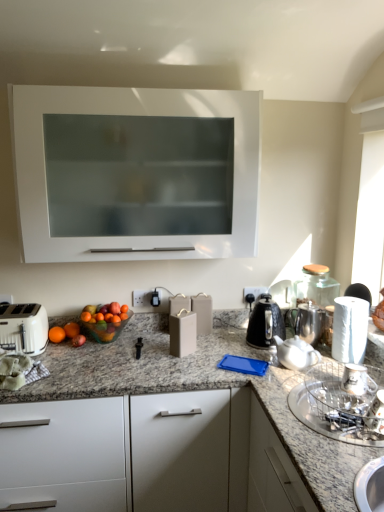
Locate an element on the screen. white matte cabinet at lower left, which appears as the first cabinetry when ordered from the bottom is located at coordinates (148, 455).

Measure the distance between stainless steel dish rack at lower right, the 2th appliance when ordered from right to left, and camera.

stainless steel dish rack at lower right, the 2th appliance when ordered from right to left, and camera are 4.22 feet apart.

At what (x,y) coordinates should I click in order to perform the action: click on stainless steel dish rack at lower right, the 2th appliance when ordered from right to left. Please return your answer as a coordinate pair (x, y). This screenshot has width=384, height=512. Looking at the image, I should click on (342, 403).

Where is `translucent glass bowl of mixed fruits at center-left`? Image resolution: width=384 pixels, height=512 pixels. translucent glass bowl of mixed fruits at center-left is located at coordinates [x=105, y=321].

Measure the distance between translucent glass bowl of mixed fruits at center-left and camera.

The depth of translucent glass bowl of mixed fruits at center-left is 6.62 feet.

Locate an element on the screen. This screenshot has width=384, height=512. white paper towel at right is located at coordinates (350, 329).

What is the approximate height of white paper towel at right?

white paper towel at right is 10.55 inches in height.

The image size is (384, 512). I want to click on black plastic electrical outlet at center, so click(253, 293).

Does orange matte at left turn towards white plastic toaster at lower left?

No, orange matte at left is not facing towards white plastic toaster at lower left.

Does point (50, 339) come closer to viewer compared to point (0, 309)?

No, it is behind (0, 309).

What's the angular difference between orange matte at left and white plastic toaster at lower left's facing directions?

The angular difference between orange matte at left and white plastic toaster at lower left is 0.0015 degrees.

Is translucent glass bowl of mixed fruits at center-left touching white plastic toaster at lower left?

No, translucent glass bowl of mixed fruits at center-left is not touching white plastic toaster at lower left.

Does translucent glass bowl of mixed fruits at center-left have a smaller size compared to white plastic toaster at lower left?

Yes.

Is translucent glass bowl of mixed fruits at center-left completely or partially outside of white plastic toaster at lower left?

Yes.

Where is `toaster below the translucent glass bowl of mixed fruits at center-left (from the image's perspective)`? The image size is (384, 512). toaster below the translucent glass bowl of mixed fruits at center-left (from the image's perspective) is located at coordinates (23, 328).

Is the position of white ceramic teapot at right more distant than that of black metallic kettle at right?

That is False.

Between point (289, 350) and point (266, 330), which one is positioned behind?

The point (266, 330) is more distant.

Measure the distance between white ceramic teapot at right and black metallic kettle at right.

The distance of white ceramic teapot at right from black metallic kettle at right is 9.73 inches.

Can you confirm if white ceramic teapot at right is shorter than black metallic kettle at right?

Yes, white ceramic teapot at right is shorter than black metallic kettle at right.

Between orange matte at left and white ceramic teapot at right, which one has larger size?

white ceramic teapot at right.

From a real-world perspective, is orange matte at left located higher than white ceramic teapot at right?

No, from a real-world perspective, orange matte at left is not above white ceramic teapot at right.

Does orange matte at left touch white ceramic teapot at right?

No, orange matte at left is not in contact with white ceramic teapot at right.

Is orange matte at left at the left side of white ceramic teapot at right?

Result: Correct, you'll find orange matte at left to the left of white ceramic teapot at right.

Considering the positions of point (44, 198) and point (364, 378), is point (44, 198) closer or farther from the camera than point (364, 378)?

Point (44, 198) is farther from the camera than point (364, 378).

At what (x,y) coordinates should I click in order to perform the action: click on cabinetry above the metallic silver cup at lower right, which is counted as the 2th appliance, starting from the back (from a real-world perspective). Please return your answer as a coordinate pair (x, y). Image resolution: width=384 pixels, height=512 pixels. Looking at the image, I should click on (135, 172).

Considering the sizes of white matte cabinet at upper center, which appears as the 2th cabinetry when ordered from the bottom, and metallic silver cup at lower right, the second appliance positioned from the front, in the image, is white matte cabinet at upper center, which appears as the 2th cabinetry when ordered from the bottom, wider or thinner than metallic silver cup at lower right, the second appliance positioned from the front,?

Considering their sizes, white matte cabinet at upper center, which appears as the 2th cabinetry when ordered from the bottom, looks broader than metallic silver cup at lower right, the second appliance positioned from the front.

Does white matte cabinet at upper center, positioned as the first cabinetry in top-to-bottom order, appear on the right side of metallic silver cup at lower right, the second appliance positioned from the front?

No.

Is white paper towel at right looking in the opposite direction of translucent glass bowl of mixed fruits at center-left?

No, white paper towel at right is not facing the opposite direction of translucent glass bowl of mixed fruits at center-left.

From the image's perspective, is white paper towel at right beneath translucent glass bowl of mixed fruits at center-left?

No, from the image's perspective, white paper towel at right is not below translucent glass bowl of mixed fruits at center-left.

Are white paper towel at right and translucent glass bowl of mixed fruits at center-left beside each other?

No, white paper towel at right is not touching translucent glass bowl of mixed fruits at center-left.

Is white paper towel at right surrounding translucent glass bowl of mixed fruits at center-left?

Definitely not — translucent glass bowl of mixed fruits at center-left is not inside white paper towel at right.

From the picture: From the image's perspective, is orange matte at left beneath translucent glass bowl of mixed fruits at center-left?

Yes, from the image's perspective, orange matte at left is below translucent glass bowl of mixed fruits at center-left.

Consider the image. Between orange matte at left and translucent glass bowl of mixed fruits at center-left, which one has less height?

orange matte at left.

Is orange matte at left further to the viewer compared to translucent glass bowl of mixed fruits at center-left?

That is True.

Based on their positions, is orange matte at left located to the left or right of translucent glass bowl of mixed fruits at center-left?

orange matte at left is to the left of translucent glass bowl of mixed fruits at center-left.

In the image, there is a white plastic toaster at lower left. Where is `citrus fruit below it (from the image's perspective)`? The height and width of the screenshot is (512, 384). citrus fruit below it (from the image's perspective) is located at coordinates tap(67, 334).

Image resolution: width=384 pixels, height=512 pixels. In order to click on toaster that appears in front of the translucent glass bowl of mixed fruits at center-left in this screenshot , I will do `click(23, 328)`.

Estimate the real-world distances between objects in this image. Which object is further from translucent glass bowl of mixed fruits at center-left, black plastic electrical outlet at center or metallic silver cup at lower right, which is counted as the 2th appliance, starting from the back?

metallic silver cup at lower right, which is counted as the 2th appliance, starting from the back.

Looking at the image, which one is located further to white ceramic teapot at right, metallic silver cup at lower right, acting as the 1th appliance starting from the right, or white matte cabinet at lower left, which appears as the first cabinetry when ordered from the bottom?

white matte cabinet at lower left, which appears as the first cabinetry when ordered from the bottom, lies further to white ceramic teapot at right than the other object.

Consider the image. Looking at the image, which one is located further to metallic silver cup at lower right, which is counted as the 2th appliance, starting from the back, matte gray wine box at center, the third appliance from the front, or stainless steel dish rack at lower right, acting as the 3th appliance starting from the back?

matte gray wine box at center, the third appliance from the front, is positioned further to the anchor metallic silver cup at lower right, which is counted as the 2th appliance, starting from the back.

When comparing their distances from black metallic kettle at right, does satin silver coffee pot at right or white plastic toaster at lower left seem closer?

satin silver coffee pot at right is positioned closer to the anchor black metallic kettle at right.

Estimate the real-world distances between objects in this image. Which object is closer to translucent glass bowl of mixed fruits at center-left, stainless steel dish rack at lower right, acting as the 3th appliance starting from the back, or satin silver coffee pot at right?

satin silver coffee pot at right is positioned closer to the anchor translucent glass bowl of mixed fruits at center-left.

Looking at the image, which one is located closer to white plastic toaster at lower left, orange matte at left or matte gray wine box at center, which appears as the third appliance when viewed from the right?

orange matte at left is positioned closer to the anchor white plastic toaster at lower left.

Which object lies further to the anchor point metallic silver cup at lower right, which is counted as the 2th appliance, starting from the back, matte gray wine box at center, which appears as the third appliance when viewed from the right, or white paper towel at right?

matte gray wine box at center, which appears as the third appliance when viewed from the right.

When comparing their distances from satin silver coffee pot at right, does white ceramic teapot at right or orange matte at left seem further?

orange matte at left.

Where is `coffeepot between stainless steel dish rack at lower right, acting as the 3th appliance starting from the back, and black plastic electrical outlet at center in the front-back direction`? The height and width of the screenshot is (512, 384). coffeepot between stainless steel dish rack at lower right, acting as the 3th appliance starting from the back, and black plastic electrical outlet at center in the front-back direction is located at coordinates (307, 321).

Locate an element on the screen. appliance situated between orange matte at left and black metallic kettle at right from left to right is located at coordinates (183, 333).

Where is `kitchen appliance that lies between white matte cabinet at upper center, which appears as the 2th cabinetry when ordered from the bottom, and white matte cabinet at lower left, which appears as the first cabinetry when ordered from the bottom, from top to bottom`? kitchen appliance that lies between white matte cabinet at upper center, which appears as the 2th cabinetry when ordered from the bottom, and white matte cabinet at lower left, which appears as the first cabinetry when ordered from the bottom, from top to bottom is located at coordinates (265, 323).

Identify the location of tea pot between white matte cabinet at upper center, positioned as the first cabinetry in top-to-bottom order, and metallic silver cup at lower right, which is counted as the 2th appliance, starting from the back, in the up-down direction. (296, 353).